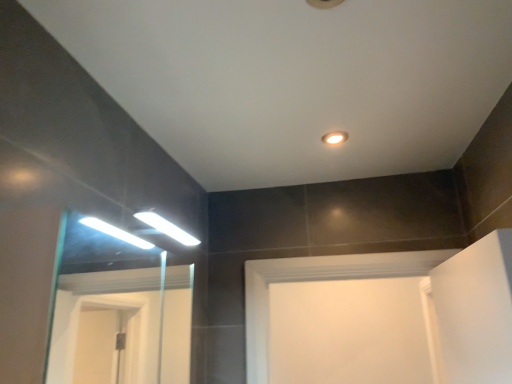
This screenshot has width=512, height=384. Describe the element at coordinates (118, 313) in the screenshot. I see `clear glass mirror at upper left` at that location.

This screenshot has width=512, height=384. In order to click on clear glass mirror at upper left in this screenshot , I will do `click(118, 313)`.

Where is `clear glass mirror at upper left`? clear glass mirror at upper left is located at coordinates (118, 313).